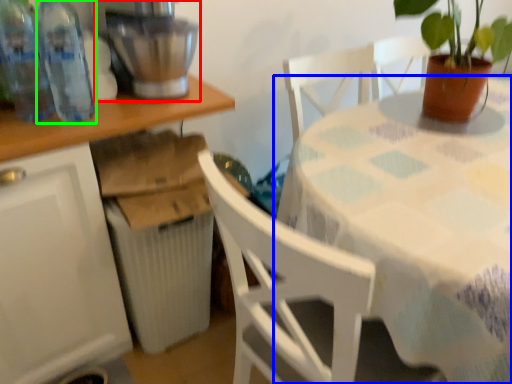
Question: Which object is the farthest from mixer (highlighted by a red box)? Choose among these: table (highlighted by a blue box) or bottle (highlighted by a green box).

Choices:
 (A) table
 (B) bottle

Answer: (A)